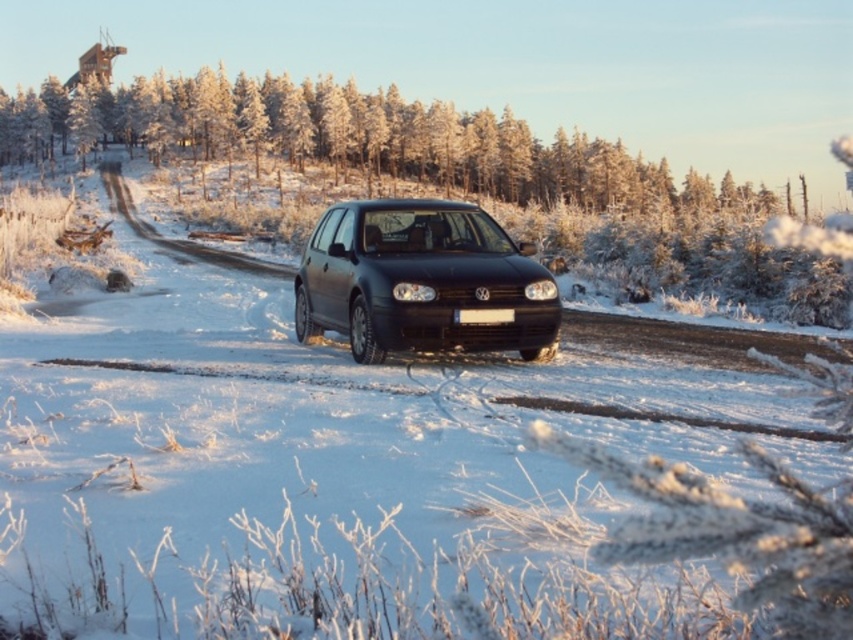
Does matte black car at center have a greater width compared to white plastic license plate at center?

Result: Correct, the width of matte black car at center exceeds that of white plastic license plate at center.

At what (x,y) coordinates should I click in order to perform the action: click on matte black car at center. Please return your answer as a coordinate pair (x, y). The height and width of the screenshot is (640, 853). Looking at the image, I should click on (421, 282).